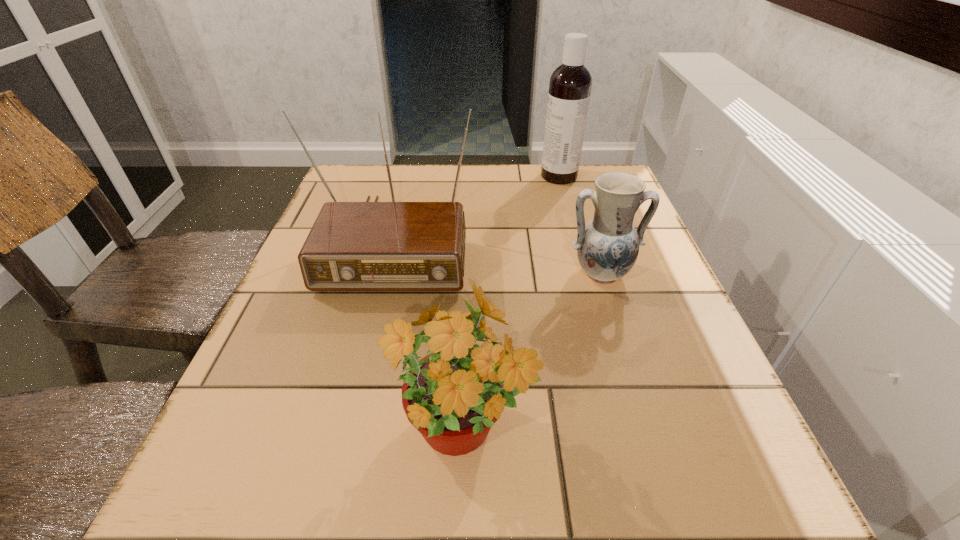
Locate an element on the screen. vacant area situated on either side of the pottery is located at coordinates (652, 435).

Identify the location of dishwasher detergent that is at the far edge. This screenshot has height=540, width=960. (570, 84).

Locate an element on the screen. radio_receiver located in the far edge section of the desktop is located at coordinates (352, 246).

Where is `object situated at the near edge`? Image resolution: width=960 pixels, height=540 pixels. object situated at the near edge is located at coordinates (467, 379).

Locate an element on the screen. This screenshot has height=540, width=960. object that is at the left edge is located at coordinates (352, 246).

This screenshot has height=540, width=960. Find the location of `dishwasher detergent present at the right edge`. dishwasher detergent present at the right edge is located at coordinates pos(570,84).

Identify the location of pottery that is positioned at the right edge. (607, 247).

Find the location of a particular element. This screenshot has height=540, width=960. object situated at the far left corner is located at coordinates (352, 246).

The width and height of the screenshot is (960, 540). In order to click on object situated at the far right corner in this screenshot , I will do `click(570, 84)`.

The width and height of the screenshot is (960, 540). In the image, there is a desktop. Find the location of `vacant space at the far edge`. vacant space at the far edge is located at coordinates (526, 204).